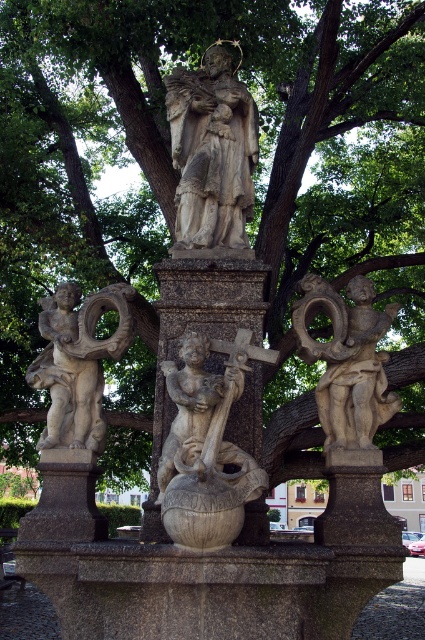
Question: Which of these objects is positioned closest to the stone angel at left?

Choices:
 (A) matte stone cherub at right
 (B) stone statue at center
 (C) carved stone cherub at center

Answer: (C)

Question: Is carved stone cherub at center positioned at the back of stone statue at center?

Choices:
 (A) yes
 (B) no

Answer: (B)

Question: Is carved stone cherub at center further to camera compared to stone statue at center?

Choices:
 (A) yes
 (B) no

Answer: (B)

Question: Which point is closer to the camera taking this photo?

Choices:
 (A) (79, 369)
 (B) (192, 97)

Answer: (A)

Question: Among these objects, which one is nearest to the camera?

Choices:
 (A) stone statue at center
 (B) stone angel at left
 (C) carved stone cherub at center
 (D) matte stone cherub at right

Answer: (C)

Question: Where is stone statue at center located in relation to matte stone cherub at right in the image?

Choices:
 (A) left
 (B) right

Answer: (A)